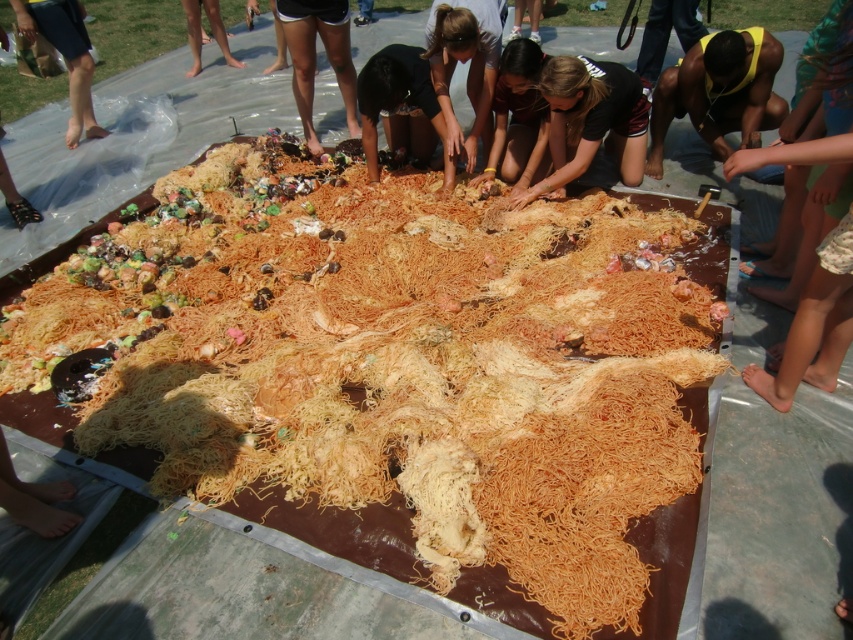
You are a photographer at the event and want to capture a photo of the smooth tan skin at center and the brown fabric bag at upper left. Which object should you focus on first to ensure both are in focus?

The smooth tan skin at center is closer to the viewer than the brown fabric bag at upper left, so you should focus on the smooth tan skin at center first to ensure both are in focus.

You are a chef preparing to serve portions of this dessert. You need to ensure that each serving has both the golden shredded noodles at center and the yellow skin at center. Given that the distance between them is 5.00 feet, what is the minimum length of the serving spoon you should use to reach both components efficiently?

The golden shredded noodles at center and the yellow skin at center are 5.00 feet apart. To efficiently reach both components with a single serving spoon, the spoon should be at least 5.00 feet long so that it can span the distance between them.

You are standing at the position of the group of people around the table. You want to grab the brown fabric bag at upper left to take a photo of the dessert. Is the smooth tan skin at center in your way?

The smooth tan skin at center is 5.06 feet away from the brown fabric bag at upper left, so it is not in your way since it is at a distance.